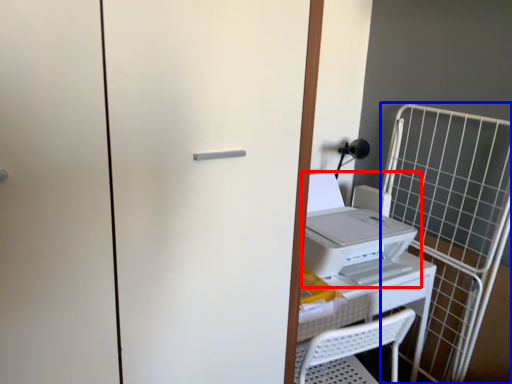
Question: Which of the following is the farthest to the observer, home appliance (highlighted by a red box) or cage (highlighted by a blue box)?

Choices:
 (A) home appliance
 (B) cage

Answer: (B)